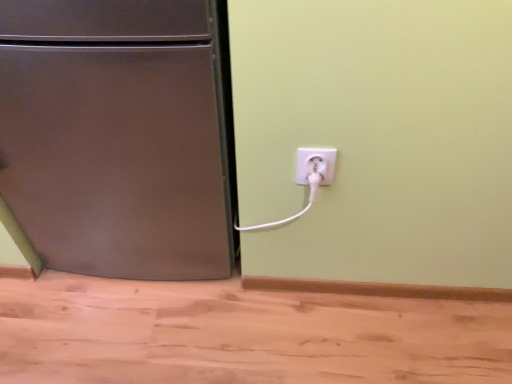
Question: Considering the relative sizes of white plastic plug at lower right and brushed metal refrigerator at left in the image provided, is white plastic plug at lower right taller than brushed metal refrigerator at left?

Choices:
 (A) no
 (B) yes

Answer: (A)

Question: From the image's perspective, is white plastic plug at lower right located beneath brushed metal refrigerator at left?

Choices:
 (A) yes
 (B) no

Answer: (A)

Question: From a real-world perspective, is white plastic plug at lower right positioned under brushed metal refrigerator at left based on gravity?

Choices:
 (A) no
 (B) yes

Answer: (A)

Question: Is white plastic plug at lower right positioned with its back to brushed metal refrigerator at left?

Choices:
 (A) yes
 (B) no

Answer: (B)

Question: Can you confirm if white plastic plug at lower right is thinner than brushed metal refrigerator at left?

Choices:
 (A) yes
 (B) no

Answer: (A)

Question: Is white plastic plug at lower right at the right side of brushed metal refrigerator at left?

Choices:
 (A) no
 (B) yes

Answer: (B)

Question: Is brushed metal refrigerator at left positioned behind white plastic plug at lower right?

Choices:
 (A) yes
 (B) no

Answer: (B)

Question: Would you say brushed metal refrigerator at left is outside white plastic plug at lower right?

Choices:
 (A) no
 (B) yes

Answer: (B)

Question: Is brushed metal refrigerator at left wider than white plastic plug at lower right?

Choices:
 (A) no
 (B) yes

Answer: (B)

Question: From the image's perspective, is brushed metal refrigerator at left on top of white plastic plug at lower right?

Choices:
 (A) no
 (B) yes

Answer: (B)

Question: Does brushed metal refrigerator at left have a smaller size compared to white plastic plug at lower right?

Choices:
 (A) yes
 (B) no

Answer: (B)

Question: Is brushed metal refrigerator at left surrounding white plastic plug at lower right?

Choices:
 (A) yes
 (B) no

Answer: (B)

Question: Is brushed metal refrigerator at left to the left or to the right of white plastic plug at lower right in the image?

Choices:
 (A) right
 (B) left

Answer: (B)